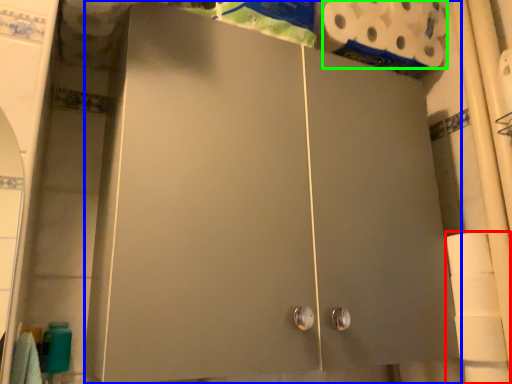
Question: Considering the real-world distances, which object is farthest from toilet paper (highlighted by a red box)? cupboard (highlighted by a blue box) or toilet paper (highlighted by a green box)?

Choices:
 (A) cupboard
 (B) toilet paper

Answer: (B)